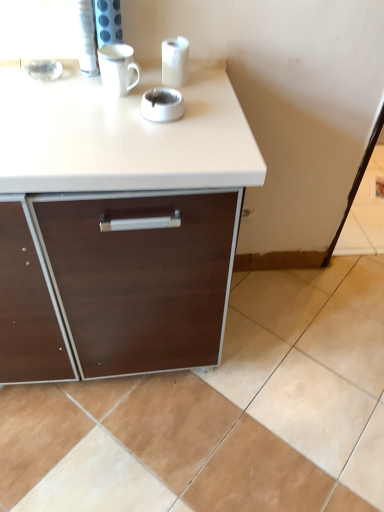
Question: Considering the positions of beige ceramic tile at lower right and white glossy ashtray at center in the image, is beige ceramic tile at lower right taller or shorter than white glossy ashtray at center?

Choices:
 (A) tall
 (B) short

Answer: (B)

Question: Is beige ceramic tile at lower right situated inside white glossy ashtray at center or outside?

Choices:
 (A) outside
 (B) inside

Answer: (A)

Question: Which object is positioned closest to the white glossy ashtray at center?

Choices:
 (A) white glossy mug at upper center
 (B) white glossy paper towel at upper center
 (C) beige ceramic tile at lower right

Answer: (A)

Question: Which object is positioned farthest from the beige ceramic tile at lower right?

Choices:
 (A) white glossy mug at upper center
 (B) white glossy ashtray at center
 (C) white glossy paper towel at upper center

Answer: (A)